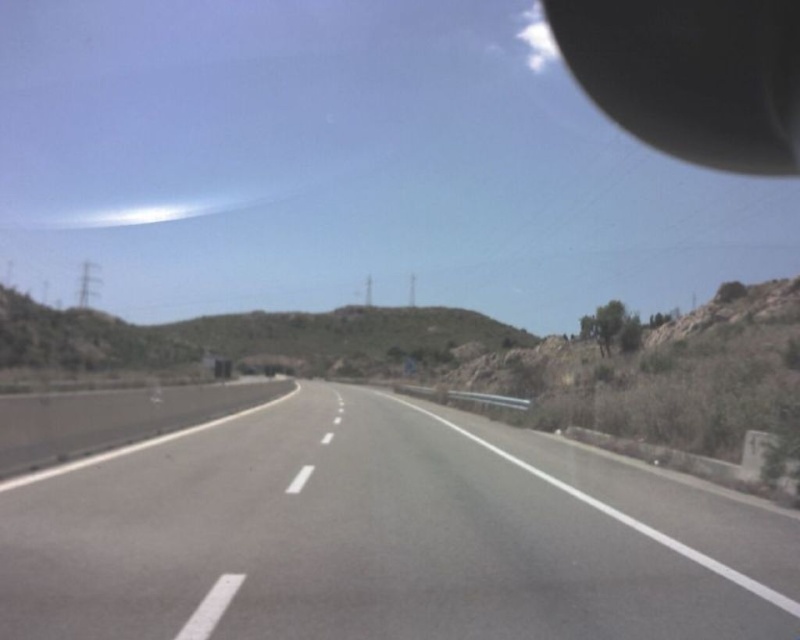
You are driving a car and looking through the windshield. You see the smooth asphalt highway at center and the black matte rearview mirror at upper right. Which object is closer to your eyes?

The black matte rearview mirror at upper right is closer to your eyes because it is positioned above and in front of the windshield, while the smooth asphalt highway at center is further away on the road ahead.

You are a drone operator planning to fly a drone from the point at coordinates point (354, 563) to the point at coordinates point (586, 48). Considering the highway and surrounding terrain, which point is closer to you, the operator, as you begin the flight?

Point (354, 563) is closer to the viewer than point (586, 48), so the starting point is nearer to you.